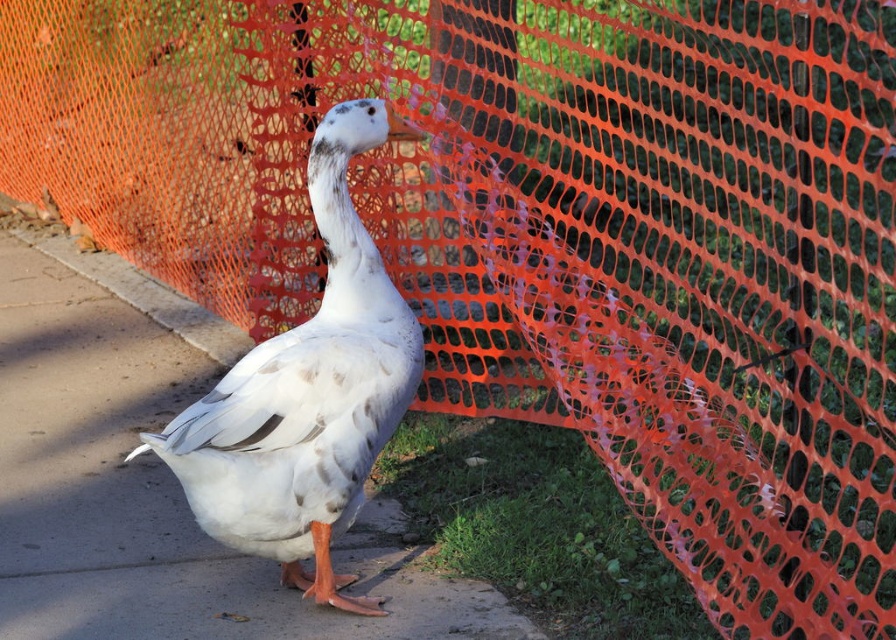
Question: Is white matte pavement at center further to camera compared to concrete at lower left?

Choices:
 (A) yes
 (B) no

Answer: (B)

Question: Does white matte pavement at center have a greater width compared to white matte duck at center?

Choices:
 (A) no
 (B) yes

Answer: (B)

Question: Which object appears farthest from the camera in this image?

Choices:
 (A) white matte duck at center
 (B) white matte pavement at center
 (C) concrete at lower left

Answer: (C)

Question: Which point is farther to the camera?

Choices:
 (A) (229, 323)
 (B) (338, 228)

Answer: (A)

Question: Does white matte pavement at center come behind concrete at lower left?

Choices:
 (A) yes
 (B) no

Answer: (B)

Question: Which point is farther from the camera taking this photo?

Choices:
 (A) (69, 582)
 (B) (73, 262)
 (C) (300, 483)

Answer: (B)